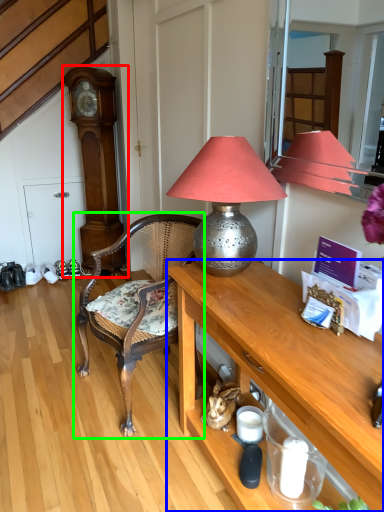
Question: Which object is positioned closest to clock (highlighted by a red box)? Select from desk (highlighted by a blue box) and chair (highlighted by a green box).

Choices:
 (A) desk
 (B) chair

Answer: (B)